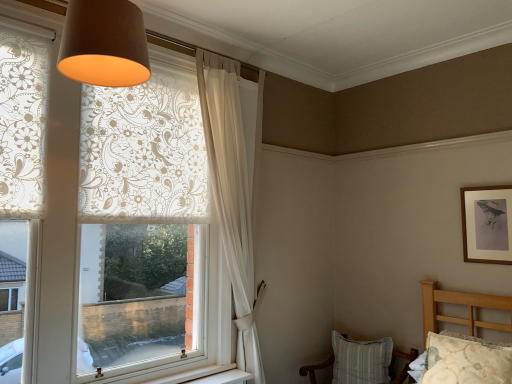
Question: Does white sheer curtain at upper center contain striped fabric chair at lower right?

Choices:
 (A) no
 (B) yes

Answer: (A)

Question: Could you tell me if white sheer curtain at upper center is turned towards striped fabric chair at lower right?

Choices:
 (A) yes
 (B) no

Answer: (B)

Question: Can you confirm if white sheer curtain at upper center is positioned to the left of striped fabric chair at lower right?

Choices:
 (A) no
 (B) yes

Answer: (B)

Question: Is white sheer curtain at upper center wider than striped fabric chair at lower right?

Choices:
 (A) no
 (B) yes

Answer: (A)

Question: From the image's perspective, is white sheer curtain at upper center over striped fabric chair at lower right?

Choices:
 (A) no
 (B) yes

Answer: (B)

Question: From their relative heights in the image, would you say white sheer curtain at upper center is taller or shorter than wooden framed print at upper right?

Choices:
 (A) tall
 (B) short

Answer: (A)

Question: In the image, is white sheer curtain at upper center positioned in front of or behind wooden framed print at upper right?

Choices:
 (A) behind
 (B) front

Answer: (B)

Question: Is white sheer curtain at upper center wider or thinner than wooden framed print at upper right?

Choices:
 (A) thin
 (B) wide

Answer: (B)

Question: From a real-world perspective, relative to wooden framed print at upper right, is white sheer curtain at upper center vertically above or below?

Choices:
 (A) above
 (B) below

Answer: (B)

Question: Is point (493, 380) positioned closer to the camera than point (464, 254)?

Choices:
 (A) closer
 (B) farther

Answer: (A)

Question: Looking at their shapes, would you say floral fabric pillow at lower right is wider or thinner than wooden framed print at upper right?

Choices:
 (A) thin
 (B) wide

Answer: (B)

Question: From their relative heights in the image, would you say floral fabric pillow at lower right is taller or shorter than wooden framed print at upper right?

Choices:
 (A) tall
 (B) short

Answer: (B)

Question: From the image's perspective, is floral fabric pillow at lower right above or below wooden framed print at upper right?

Choices:
 (A) above
 (B) below

Answer: (B)

Question: Is floral fabric pillow at lower right to the left or to the right of brown fabric lampshade at upper center in the image?

Choices:
 (A) right
 (B) left

Answer: (A)

Question: Looking at their shapes, would you say floral fabric pillow at lower right is wider or thinner than brown fabric lampshade at upper center?

Choices:
 (A) thin
 (B) wide

Answer: (A)